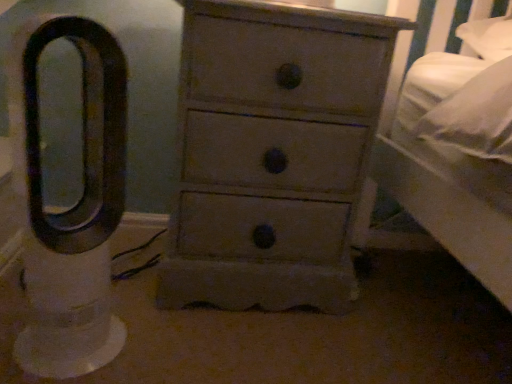
Identify the location of free space between matte gray chest of drawers at center and white plastic fan at left. This screenshot has height=384, width=512. (180, 327).